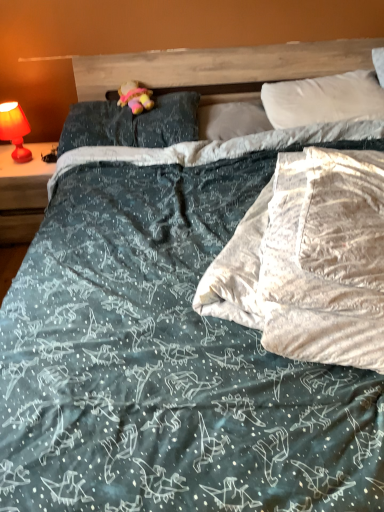
What is the approximate width of matte red lamp at left?

matte red lamp at left is 18.77 inches in width.

Measure the distance between point (218, 104) and camera.

Point (218, 104) and camera are 7.12 feet apart from each other.

The image size is (384, 512). Identify the location of white soft pillow at upper right, which is the 1th pillow in right-to-left order. (323, 100).

What do you see at coordinates (135, 97) in the screenshot? I see `pastel plush toy at center` at bounding box center [135, 97].

The height and width of the screenshot is (512, 384). Identify the location of dark blue fabric pillow at upper center, arranged as the first pillow when viewed from the left. (131, 123).

Image resolution: width=384 pixels, height=512 pixels. Find the location of `matte red lamp at left`. matte red lamp at left is located at coordinates (15, 129).

Who is smaller, pastel plush toy at center or dark blue fabric pillow at upper center, which ranks as the third pillow in right-to-left order?

pastel plush toy at center.

Which point is more distant from viewer, (153,104) or (194,116)?

Positioned behind is point (194,116).

Is pastel plush toy at center surrounding dark blue fabric pillow at upper center, arranged as the first pillow when viewed from the left?

No, dark blue fabric pillow at upper center, arranged as the first pillow when viewed from the left, is not inside pastel plush toy at center.

Which object is wider, pastel plush toy at center or dark blue fabric pillow at upper center, arranged as the first pillow when viewed from the left?

dark blue fabric pillow at upper center, arranged as the first pillow when viewed from the left, is wider.

What are the coordinates of `nightstand on the left side of white soft pillow at center, marked as the second pillow in a left-to-right arrangement` in the screenshot? It's located at (23, 193).

How different are the orientations of white soft pillow at center, marked as the second pillow in a left-to-right arrangement, and matte red lamp at left in degrees?

The angular difference between white soft pillow at center, marked as the second pillow in a left-to-right arrangement, and matte red lamp at left is 0.106 degrees.

Is white soft pillow at center, which is the 2th pillow from right to left, turned away from matte red lamp at left?

No, matte red lamp at left is not at the back of white soft pillow at center, which is the 2th pillow from right to left.

Is matte red lamp at left surrounded by white soft pillow at center, marked as the second pillow in a left-to-right arrangement?

No, matte red lamp at left is not a part of white soft pillow at center, marked as the second pillow in a left-to-right arrangement.

Could you tell me if white soft pillow at upper right, which is the 1th pillow in right-to-left order, is facing matte red lamp at left?

No, white soft pillow at upper right, which is the 1th pillow in right-to-left order, is not turned towards matte red lamp at left.

Is white soft pillow at upper right, marked as the 3th pillow in a left-to-right arrangement, behind matte red lamp at left?

No, the depth of white soft pillow at upper right, marked as the 3th pillow in a left-to-right arrangement, is less than that of matte red lamp at left.

What's the angular difference between white soft pillow at upper right, marked as the 3th pillow in a left-to-right arrangement, and matte red lamp at left's facing directions?

The facing directions of white soft pillow at upper right, marked as the 3th pillow in a left-to-right arrangement, and matte red lamp at left are 0.801 degrees apart.

Based on their positions, is white soft pillow at upper right, marked as the 3th pillow in a left-to-right arrangement, located to the left or right of pastel plush toy at center?

white soft pillow at upper right, marked as the 3th pillow in a left-to-right arrangement, is positioned on pastel plush toy at center's right side.

Is white soft pillow at upper right, marked as the 3th pillow in a left-to-right arrangement, facing away from pastel plush toy at center?

No, white soft pillow at upper right, marked as the 3th pillow in a left-to-right arrangement, is not facing away from pastel plush toy at center.

Does white soft pillow at upper right, marked as the 3th pillow in a left-to-right arrangement, have a lesser height compared to pastel plush toy at center?

In fact, white soft pillow at upper right, marked as the 3th pillow in a left-to-right arrangement, may be taller than pastel plush toy at center.

Is dark blue fabric pillow at upper center, arranged as the first pillow when viewed from the left, with pastel plush toy at center?

No, dark blue fabric pillow at upper center, arranged as the first pillow when viewed from the left, is not next to pastel plush toy at center.

The width and height of the screenshot is (384, 512). Identify the location of figurine above the dark blue fabric pillow at upper center, arranged as the first pillow when viewed from the left (from a real-world perspective). (135, 97).

Is dark blue fabric pillow at upper center, arranged as the first pillow when viewed from the left, inside or outside of pastel plush toy at center?

dark blue fabric pillow at upper center, arranged as the first pillow when viewed from the left, is spatially situated outside pastel plush toy at center.

Considering the relative sizes of dark blue fabric pillow at upper center, which ranks as the third pillow in right-to-left order, and pastel plush toy at center in the image provided, is dark blue fabric pillow at upper center, which ranks as the third pillow in right-to-left order, taller than pastel plush toy at center?

Incorrect, the height of dark blue fabric pillow at upper center, which ranks as the third pillow in right-to-left order, is not larger of that of pastel plush toy at center.

Image resolution: width=384 pixels, height=512 pixels. In order to click on pillow that appears above the dark blue fabric pillow at upper center, which ranks as the third pillow in right-to-left order (from a real-world perspective) in this screenshot , I will do `click(323, 100)`.

Based on the photo, how distant is dark blue fabric pillow at upper center, arranged as the first pillow when viewed from the left, from white soft pillow at upper right, marked as the 3th pillow in a left-to-right arrangement?

dark blue fabric pillow at upper center, arranged as the first pillow when viewed from the left, and white soft pillow at upper right, marked as the 3th pillow in a left-to-right arrangement, are 25.16 inches apart from each other.

Which point is more distant from viewer, (x=192, y=130) or (x=355, y=97)?

The point (x=355, y=97) is more distant.

From the picture: From their relative heights in the image, would you say dark blue fabric pillow at upper center, arranged as the first pillow when viewed from the left, is taller or shorter than white soft pillow at upper right, marked as the 3th pillow in a left-to-right arrangement?

In the image, dark blue fabric pillow at upper center, arranged as the first pillow when viewed from the left, appears to be shorter than white soft pillow at upper right, marked as the 3th pillow in a left-to-right arrangement.

Image resolution: width=384 pixels, height=512 pixels. Identify the location of bedside lamp below the white soft pillow at upper right, which is the 1th pillow in right-to-left order (from a real-world perspective). (15, 129).

In terms of height, does matte red lamp at left look taller or shorter compared to white soft pillow at upper right, which is the 1th pillow in right-to-left order?

In the image, matte red lamp at left appears to be taller than white soft pillow at upper right, which is the 1th pillow in right-to-left order.

From a real-world perspective, is matte red lamp at left on white soft pillow at upper right, marked as the 3th pillow in a left-to-right arrangement?

Actually, matte red lamp at left is physically below white soft pillow at upper right, marked as the 3th pillow in a left-to-right arrangement, in the real world.

Which point is more forward, (17, 108) or (318, 78)?

The point (17, 108) is more forward.

Locate an element on the screen. the 3rd pillow below when counting from the pastel plush toy at center (from the image's perspective) is located at coordinates (131, 123).

Identify the location of nightstand below the white soft pillow at center, which is the 2th pillow from right to left (from a real-world perspective). This screenshot has height=512, width=384. (23, 193).

From the image, which object appears to be farther from pastel plush toy at center, matte red lamp at left or white soft pillow at upper right, which is the 1th pillow in right-to-left order?

white soft pillow at upper right, which is the 1th pillow in right-to-left order, is positioned further to the anchor pastel plush toy at center.

When comparing their distances from white soft pillow at center, marked as the second pillow in a left-to-right arrangement, does dark blue fabric pillow at upper center, arranged as the first pillow when viewed from the left, or matte red lamp at left seem closer?

Among the two, dark blue fabric pillow at upper center, arranged as the first pillow when viewed from the left, is located nearer to white soft pillow at center, marked as the second pillow in a left-to-right arrangement.

Estimate the real-world distances between objects in this image. Which object is further from white soft pillow at center, marked as the second pillow in a left-to-right arrangement, pastel plush toy at center or matte red lamp at left?

matte red lamp at left.

From the image, which object appears to be nearer to white soft pillow at upper right, which is the 1th pillow in right-to-left order, matte red lamp at left or white soft pillow at center, marked as the second pillow in a left-to-right arrangement?

white soft pillow at center, marked as the second pillow in a left-to-right arrangement, is closer to white soft pillow at upper right, which is the 1th pillow in right-to-left order.

Based on their spatial positions, is pastel plush toy at center or white soft pillow at upper right, marked as the 3th pillow in a left-to-right arrangement, further from matte red lamp at left?

Among the two, white soft pillow at upper right, marked as the 3th pillow in a left-to-right arrangement, is located further to matte red lamp at left.

Based on the photo, when comparing their distances from white soft pillow at upper right, marked as the 3th pillow in a left-to-right arrangement, does dark blue fabric pillow at upper center, which ranks as the third pillow in right-to-left order, or white soft pillow at center, marked as the second pillow in a left-to-right arrangement, seem further?

The object further to white soft pillow at upper right, marked as the 3th pillow in a left-to-right arrangement, is dark blue fabric pillow at upper center, which ranks as the third pillow in right-to-left order.

Based on the photo, estimate the real-world distances between objects in this image. Which object is further from matte red lamp at left, pastel plush toy at center or white soft pillow at center, marked as the second pillow in a left-to-right arrangement?

Among the two, white soft pillow at center, marked as the second pillow in a left-to-right arrangement, is located further to matte red lamp at left.

Estimate the real-world distances between objects in this image. Which object is further from pastel plush toy at center, white soft pillow at upper right, marked as the 3th pillow in a left-to-right arrangement, or matte red lamp at left?

white soft pillow at upper right, marked as the 3th pillow in a left-to-right arrangement, is further to pastel plush toy at center.

Find the location of a particular element. The width and height of the screenshot is (384, 512). figurine between matte red lamp at left and white soft pillow at center, marked as the second pillow in a left-to-right arrangement, in the horizontal direction is located at coordinates (135, 97).

At what (x,y) coordinates should I click in order to perform the action: click on figurine between dark blue fabric pillow at upper center, arranged as the first pillow when viewed from the left, and white soft pillow at center, which is the 2th pillow from right to left, from left to right. Please return your answer as a coordinate pair (x, y). This screenshot has height=512, width=384. Looking at the image, I should click on (135, 97).

Locate an element on the screen. This screenshot has width=384, height=512. pillow between matte red lamp at left and pastel plush toy at center from left to right is located at coordinates (131, 123).

Locate an element on the screen. This screenshot has height=512, width=384. pillow between matte red lamp at left and pastel plush toy at center from left to right is located at coordinates (131, 123).